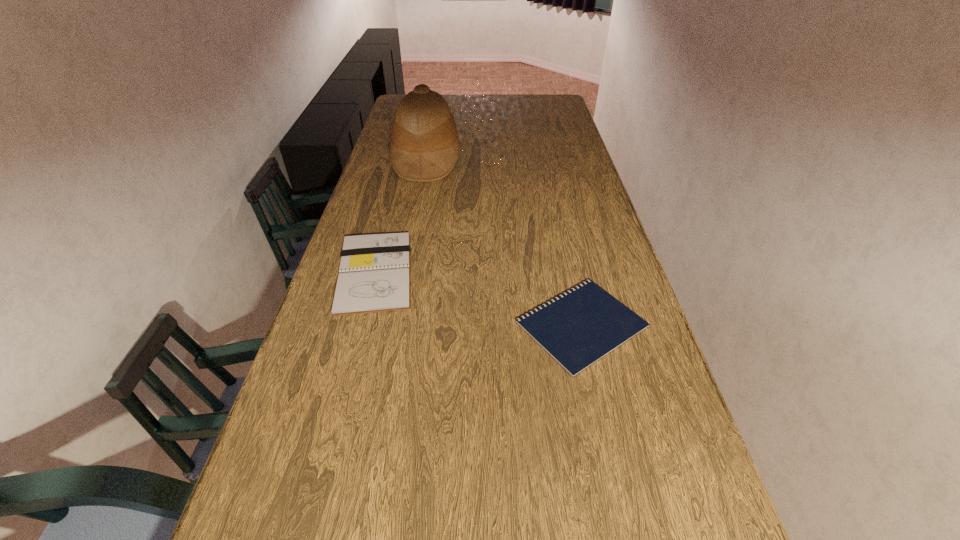
Locate an element on the screen. blank region between the hat and the shorter notepad is located at coordinates (504, 242).

At what (x,y) coordinates should I click in order to perform the action: click on vacant area that lies between the rightmost object and the tallest object. Please return your answer as a coordinate pair (x, y). The width and height of the screenshot is (960, 540). Looking at the image, I should click on (504, 242).

The height and width of the screenshot is (540, 960). In order to click on free point between the shorter notepad and the hat in this screenshot , I will do `click(504, 242)`.

You are a GUI agent. You are given a task and a screenshot of the screen. Output one action in this format:
    pyautogui.click(x=<x>, y=<y>)
    Task: Click on the vacant region between the left notepad and the hat
    
    Given the screenshot: What is the action you would take?
    pyautogui.click(x=400, y=217)

I want to click on vacant space that is in between the hat and the shorter notepad, so click(504, 242).

This screenshot has width=960, height=540. I want to click on the closest object relative to the tallest object, so click(374, 276).

You are a GUI agent. You are given a task and a screenshot of the screen. Output one action in this format:
    pyautogui.click(x=<x>, y=<y>)
    Task: Click on the object identified as the closest to the taller notepad
    
    Given the screenshot: What is the action you would take?
    pyautogui.click(x=578, y=328)

Locate an element on the screen. This screenshot has width=960, height=540. free space that satisfies the following two spatial constraints: 1. on the front-facing side of the hat; 2. on the front side of the left notepad is located at coordinates (405, 273).

At what (x,y) coordinates should I click in order to perform the action: click on vacant space that satisfies the following two spatial constraints: 1. on the front-facing side of the rightmost object; 2. on the right side of the farthest object. Please return your answer as a coordinate pair (x, y). Looking at the image, I should click on (396, 325).

Where is `vacant space that satisfies the following two spatial constraints: 1. on the front-facing side of the shortest object; 2. on the left side of the hat`? vacant space that satisfies the following two spatial constraints: 1. on the front-facing side of the shortest object; 2. on the left side of the hat is located at coordinates (396, 325).